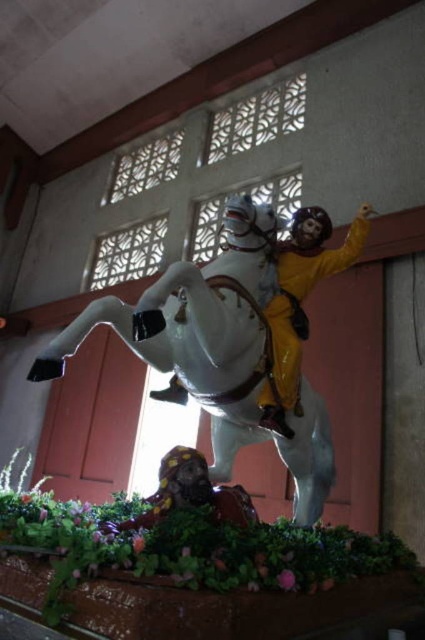
You are an art conservator examining the statue. You need to clean the glossy white horse at center and the smooth yellow helmet at lower center. Which object should you clean first if you want to start with the one that is higher up?

The glossy white horse at center is positioned over the smooth yellow helmet at lower center, so you should clean the glossy white horse at center first as it is higher up.

You are an art student analyzing the statue. You notice the glossy white horse at center and the yellow matte figure at upper center. Which object is located to the right of the other?

The yellow matte figure at upper center is to the right of the glossy white horse at center.

You are a photographer trying to capture the statue of the rider and horse. You want to ensure that both points, point (57, 374) and point (197, 486), are in focus. Which point should you focus on first to ensure the other is also in focus?

Point (57, 374) is closer to the camera than point (197, 486). Therefore, focusing on the closer point first will ensure the farther point is also in focus.